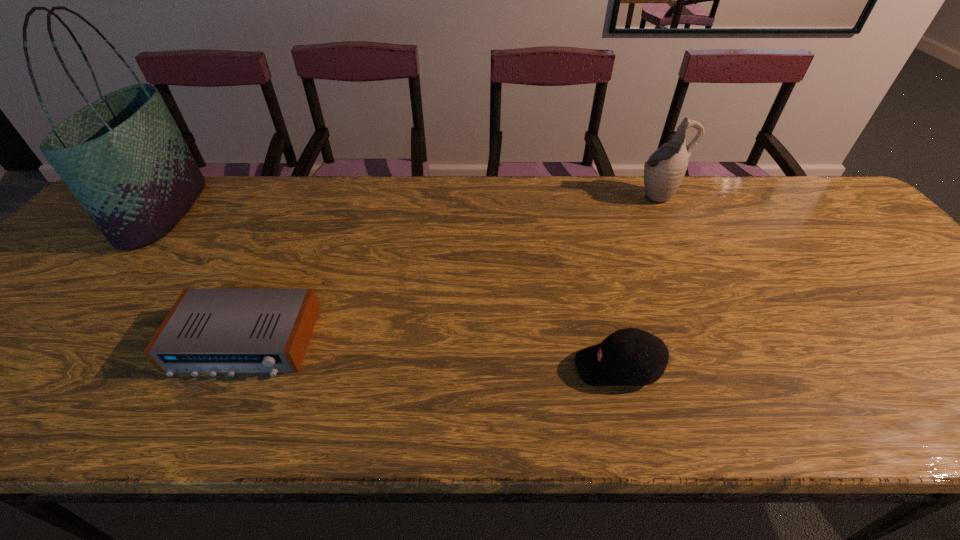
In order to click on vacant area that lies between the pitcher and the radio receiver in this screenshot , I will do `click(451, 268)`.

The height and width of the screenshot is (540, 960). What are the coordinates of `vacant point located between the baseball cap and the second object from left to right` in the screenshot? It's located at (431, 354).

The height and width of the screenshot is (540, 960). Identify the location of free space between the rightmost object and the third tallest object. (638, 281).

Find the location of `unoccupied area between the pitcher and the second shortest object`. unoccupied area between the pitcher and the second shortest object is located at coordinates (638, 281).

What are the coordinates of `empty space between the tallest object and the third tallest object` in the screenshot? It's located at (391, 289).

You are a GUI agent. You are given a task and a screenshot of the screen. Output one action in this format:
    pyautogui.click(x=<x>, y=<y>)
    Task: Click on the object that is the closest to the third object from left to right
    
    Given the screenshot: What is the action you would take?
    pyautogui.click(x=664, y=170)

The height and width of the screenshot is (540, 960). In order to click on object that is the second closest to the rightmost object in this screenshot , I will do `click(212, 331)`.

You are a GUI agent. You are given a task and a screenshot of the screen. Output one action in this format:
    pyautogui.click(x=<x>, y=<y>)
    Task: Click on the vacant space that satisfies the following two spatial constraints: 1. at the spout of the pitcher; 2. on the control panel of the third object from right to left
    
    Given the screenshot: What is the action you would take?
    (x=732, y=342)

Where is `vacant space that satisfies the following two spatial constraints: 1. at the spout of the pitcher; 2. on the front side of the tallest object`? Image resolution: width=960 pixels, height=540 pixels. vacant space that satisfies the following two spatial constraints: 1. at the spout of the pitcher; 2. on the front side of the tallest object is located at coordinates (666, 211).